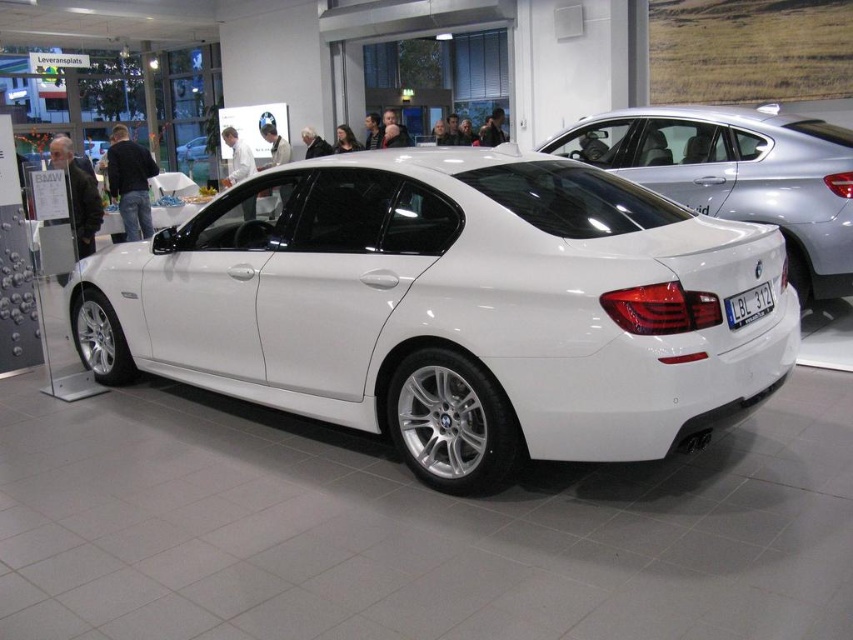
You are a photographer trying to capture the white glossy sedan at center and the blue metallic license plate at rear in a single frame. Given that the sedan is larger in the image, which object would appear bigger in your photo?

The white glossy sedan at center appears bigger in the photo because it has a larger size compared to the blue metallic license plate at rear.

You are a photographer standing in the showroom and want to take a photo of the white metallic car at center without the blue metallic license plate at rear being visible. Is this possible given their positions?

The white metallic car at center is in front of the blue metallic license plate at rear, so taking a photo from the front angle would hide the blue metallic license plate at rear behind the car.

You are a customer in the showroom and want to walk from the entrance to the white glossy sedan at center. There is a white metallic car at center blocking your path. Can you walk around it on the right side?

The white metallic car at center is to the left of the white glossy sedan at center, so you can walk around it on the right side.